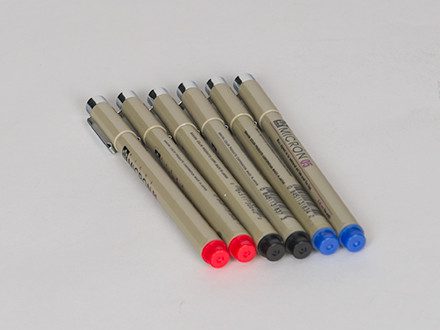
The image size is (440, 330). I want to click on pens, so click(x=159, y=185), click(x=184, y=176), click(x=214, y=166), click(x=234, y=159), click(x=262, y=152), click(x=282, y=146).